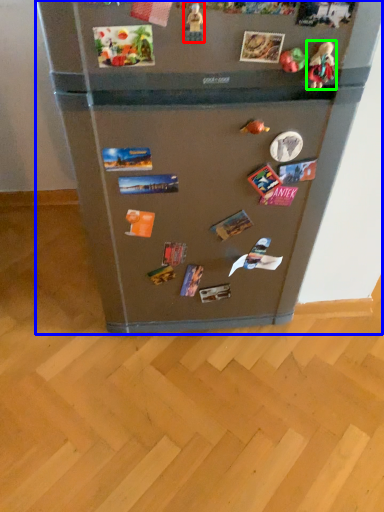
Question: Estimate the real-world distances between objects in this image. Which object is farther from toy (highlighted by a red box), refrigerator (highlighted by a blue box) or toy (highlighted by a green box)?

Choices:
 (A) refrigerator
 (B) toy

Answer: (A)